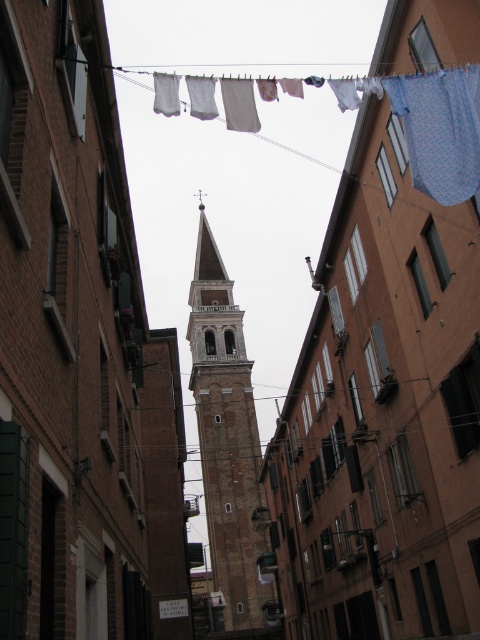
Question: Is light brown stone tower at center closer to the viewer compared to blue printed fabric at upper right?

Choices:
 (A) yes
 (B) no

Answer: (B)

Question: Which point is closer to the camera?

Choices:
 (A) light brown stone tower at center
 (B) blue printed fabric at upper right

Answer: (B)

Question: Can you confirm if light brown stone tower at center is thinner than blue printed fabric at upper right?

Choices:
 (A) no
 (B) yes

Answer: (A)

Question: Can you confirm if light brown stone tower at center is positioned above blue printed fabric at upper right?

Choices:
 (A) yes
 (B) no

Answer: (B)